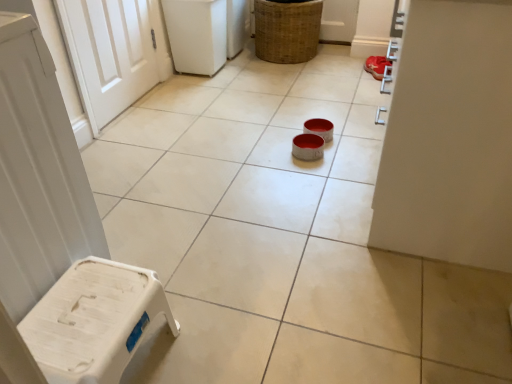
What are the coordinates of `vacant area to the left of red suede shoe at upper right` in the screenshot? It's located at (344, 77).